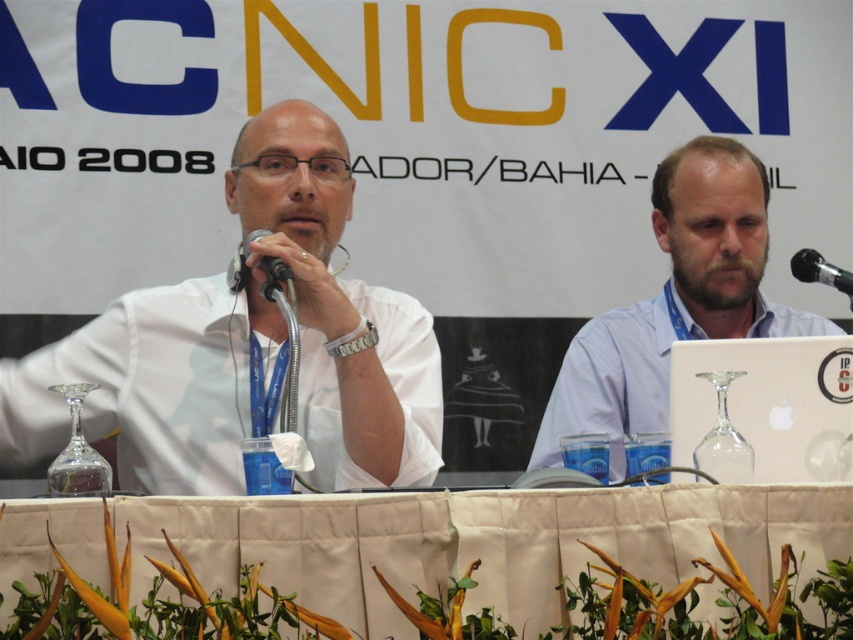
Based on the photo, is black metallic microphone at center to the right of black metallic microphone at upper right from the viewer's perspective?

Incorrect, black metallic microphone at center is not on the right side of black metallic microphone at upper right.

What do you see at coordinates (241, 260) in the screenshot?
I see `black metallic microphone at center` at bounding box center [241, 260].

Which is in front, point (247, 234) or point (817, 260)?

Point (247, 234) is in front.

Locate an element on the screen. black metallic microphone at center is located at coordinates (241, 260).

Who is more forward, (x=190, y=515) or (x=265, y=291)?

Point (x=190, y=515) is in front.

Does white fabric table at center appear under black metallic microphone at center?

Yes.

Is point (108, 504) farther from camera compared to point (252, 234)?

No, (108, 504) is in front of (252, 234).

Identify the location of white fabric table at center. (x=436, y=564).

Who is positioned more to the left, white fabric table at center or light blue shirt at right?

From the viewer's perspective, white fabric table at center appears more on the left side.

Which is more to the right, white fabric table at center or light blue shirt at right?

→ light blue shirt at right is more to the right.

Measure the distance between point (792, 616) and camera.

The distance of point (792, 616) from camera is 2.41 meters.

The width and height of the screenshot is (853, 640). I want to click on white fabric table at center, so click(x=436, y=564).